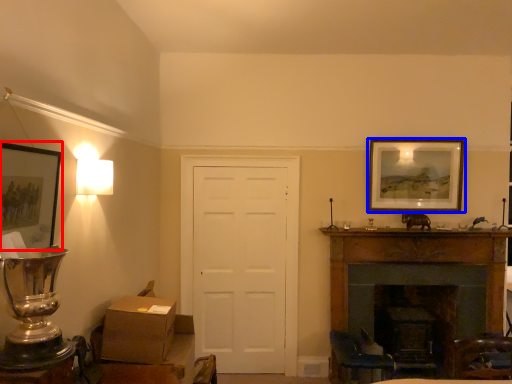
Question: Which point is further to the camera, picture frame (highlighted by a red box) or picture frame (highlighted by a blue box)?

Choices:
 (A) picture frame
 (B) picture frame

Answer: (B)